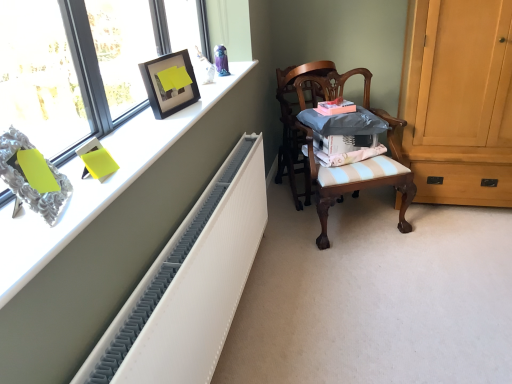
Question: Considering the relative positions of light brown wood cabinet at right and white textured radiator at left in the image provided, is light brown wood cabinet at right to the left of white textured radiator at left from the viewer's perspective?

Choices:
 (A) yes
 (B) no

Answer: (B)

Question: Is white textured radiator at left a part of light brown wood cabinet at right?

Choices:
 (A) yes
 (B) no

Answer: (B)

Question: Is the depth of light brown wood cabinet at right greater than that of white textured radiator at left?

Choices:
 (A) yes
 (B) no

Answer: (A)

Question: Is light brown wood cabinet at right facing towards white textured radiator at left?

Choices:
 (A) yes
 (B) no

Answer: (B)

Question: Can we say light brown wood cabinet at right lies outside white textured radiator at left?

Choices:
 (A) yes
 (B) no

Answer: (A)

Question: Would you say wooden chair at center, placed as the 2th chair when sorted from back to front, is to the left or to the right of matte black picture frame at upper left in the picture?

Choices:
 (A) left
 (B) right

Answer: (B)

Question: Choose the correct answer: Is wooden chair at center, placed as the 2th chair when sorted from back to front, inside matte black picture frame at upper left or outside it?

Choices:
 (A) inside
 (B) outside

Answer: (B)

Question: From the image's perspective, is wooden chair at center, placed as the 1th chair when sorted from front to back, above or below matte black picture frame at upper left?

Choices:
 (A) above
 (B) below

Answer: (B)

Question: Is wooden chair at center, placed as the 1th chair when sorted from front to back, taller or shorter than matte black picture frame at upper left?

Choices:
 (A) tall
 (B) short

Answer: (A)

Question: Looking at their shapes, would you say matte glass window at upper left is wider or thinner than wooden chair at center, marked as the second chair in a front-to-back arrangement?

Choices:
 (A) wide
 (B) thin

Answer: (B)

Question: Is matte glass window at upper left to the left or to the right of wooden chair at center, the 1th chair from the back, in the image?

Choices:
 (A) left
 (B) right

Answer: (A)

Question: Considering their positions, is matte glass window at upper left located in front of or behind wooden chair at center, marked as the second chair in a front-to-back arrangement?

Choices:
 (A) behind
 (B) front

Answer: (B)

Question: Is matte glass window at upper left taller or shorter than wooden chair at center, marked as the second chair in a front-to-back arrangement?

Choices:
 (A) tall
 (B) short

Answer: (B)

Question: Considering their positions, is light brown wood cabinet at right located in front of or behind white textured radiator at upper left?

Choices:
 (A) front
 (B) behind

Answer: (B)

Question: From the image's perspective, relative to white textured radiator at upper left, is light brown wood cabinet at right above or below?

Choices:
 (A) above
 (B) below

Answer: (A)